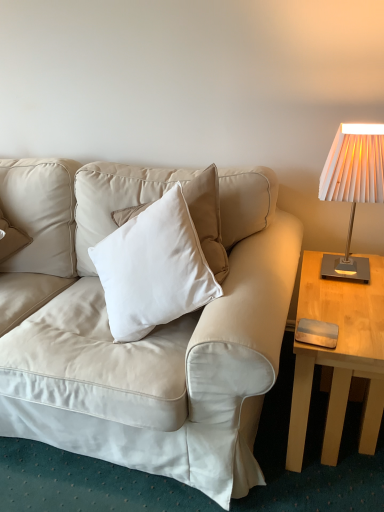
Question: Would you say white pleated fabric lampshade at right is to the left or to the right of metallic silver pad at right in the picture?

Choices:
 (A) right
 (B) left

Answer: (A)

Question: From a real-world perspective, is white pleated fabric lampshade at right positioned above or below metallic silver pad at right?

Choices:
 (A) below
 (B) above

Answer: (B)

Question: Which is farther from the beige leather couch at center?

Choices:
 (A) metallic silver pad at right
 (B) light wood table at right
 (C) beige leather pillow at upper left
 (D) white pleated fabric lampshade at right

Answer: (D)

Question: Which object is the farthest from the beige leather couch at center?

Choices:
 (A) beige leather pillow at upper left
 (B) light wood table at right
 (C) white pleated fabric lampshade at right
 (D) metallic silver pad at right

Answer: (C)